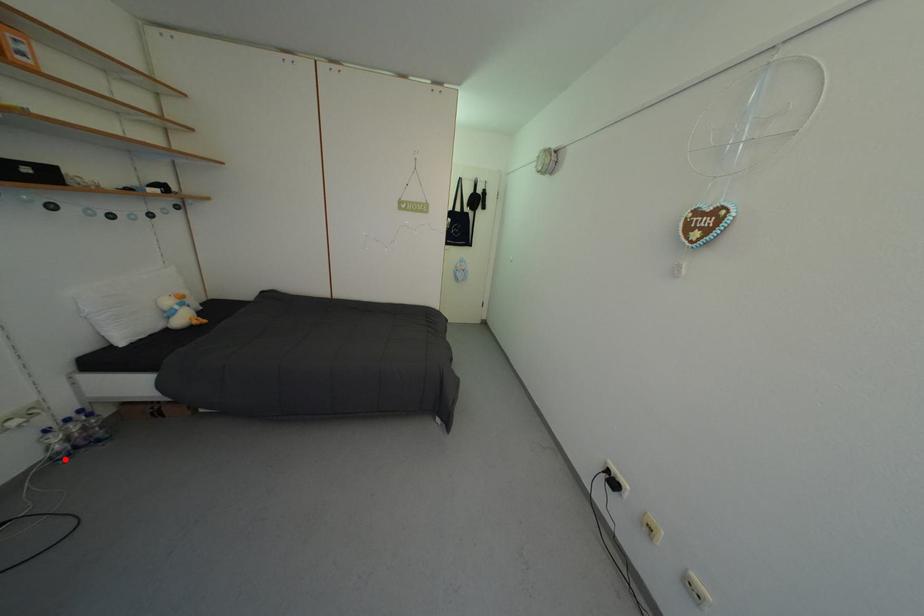
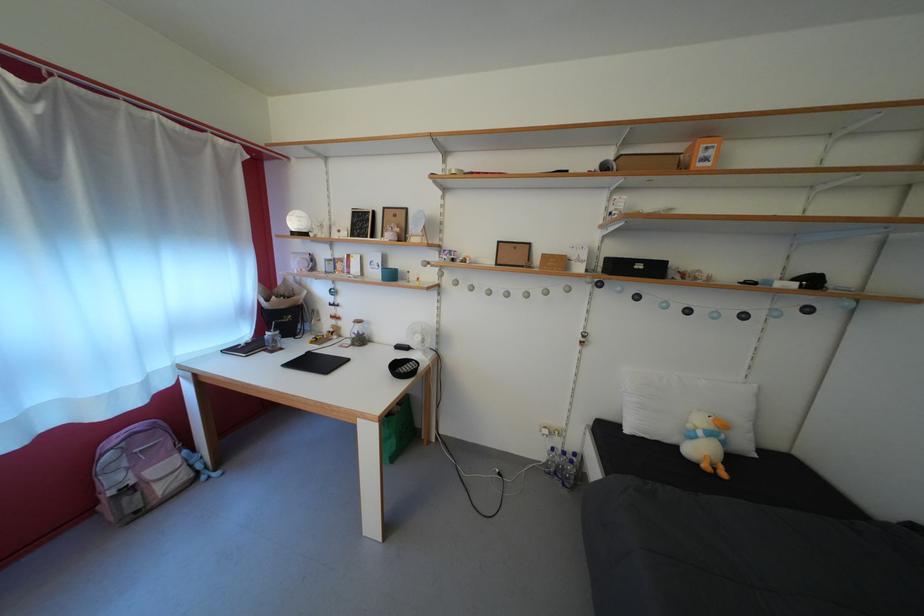
Question: I am providing you with two images of the same scene from different viewpoints. A red point is shown in image1. For the corresponding object point in image2, is it positioned nearer or farther from the camera?

Choices:
 (A) Nearer
 (B) Farther

Answer: (A)